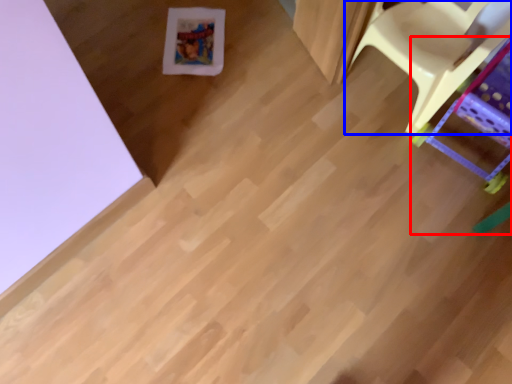
Question: Among these objects, which one is farthest to the camera, furniture (highlighted by a red box) or furniture (highlighted by a blue box)?

Choices:
 (A) furniture
 (B) furniture

Answer: (B)